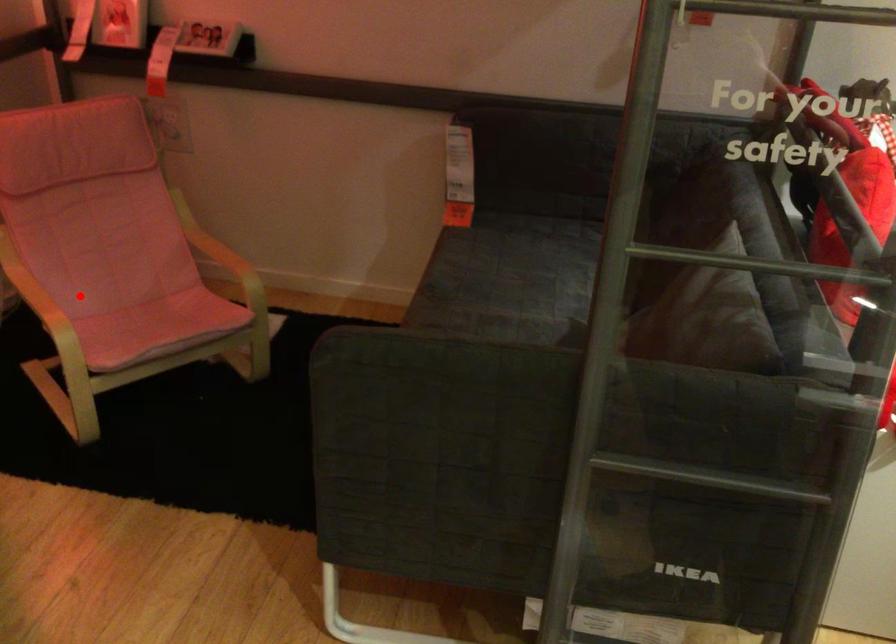
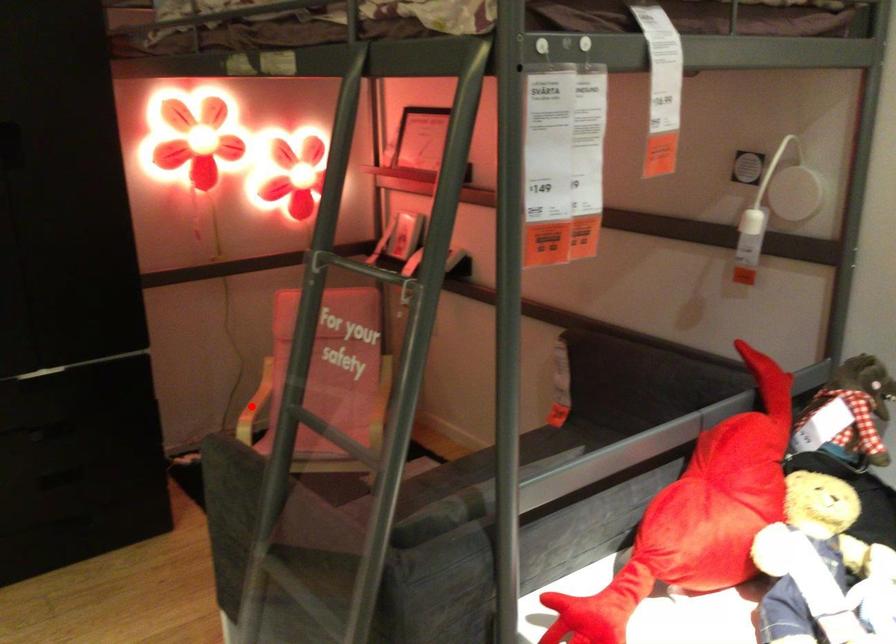
I am providing you with two images of the same scene from different viewpoints. A red point is marked on the first image and another point is marked on the second image. Does the point marked in image1 correspond to the same location as the one in image2?

Yes